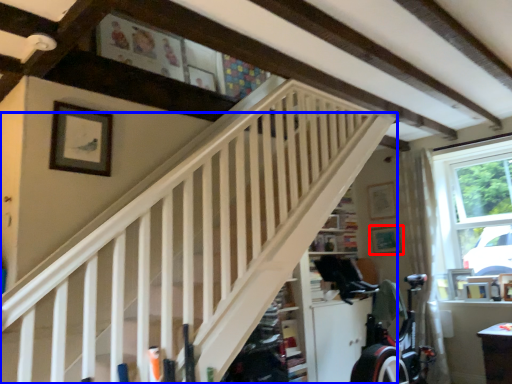
Question: Which object appears closest to the camera in this image, picture frame (highlighted by a red box) or stairs (highlighted by a blue box)?

Choices:
 (A) picture frame
 (B) stairs

Answer: (B)